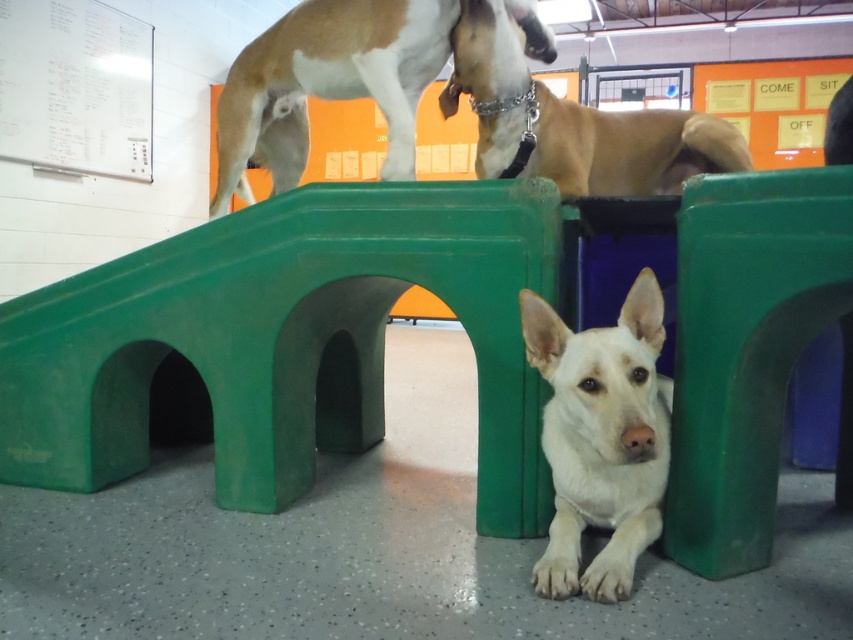
Who is higher up, green plastic hurdle at lower center or white glossy dog at upper center?

white glossy dog at upper center is above.

Can you confirm if green plastic hurdle at lower center is positioned to the left of white glossy dog at upper center?

Yes, green plastic hurdle at lower center is to the left of white glossy dog at upper center.

Where is `green plastic hurdle at lower center`? green plastic hurdle at lower center is located at coordinates (287, 340).

Which is behind, point (281, 100) or point (540, 81)?

Positioned behind is point (540, 81).

Measure the distance between white glossy dog at upper center and brown matte dog at upper center.

white glossy dog at upper center is 16.76 inches away from brown matte dog at upper center.

Find the location of a particular element. white glossy dog at upper center is located at coordinates (326, 84).

Does green plastic hurdle at lower center lie behind white matte dog at lower center?

Yes, green plastic hurdle at lower center is behind white matte dog at lower center.

Image resolution: width=853 pixels, height=640 pixels. What do you see at coordinates (287, 340) in the screenshot?
I see `green plastic hurdle at lower center` at bounding box center [287, 340].

Does point (688, 346) come farther from viewer compared to point (605, 518)?

That is False.

Where is `green plastic hurdle at lower center`? The image size is (853, 640). green plastic hurdle at lower center is located at coordinates click(287, 340).